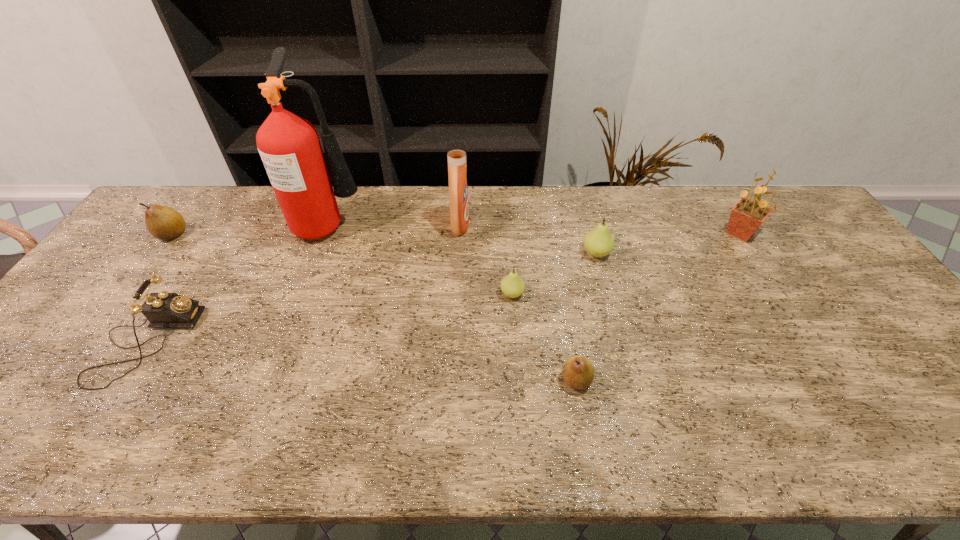
This screenshot has width=960, height=540. Identify the location of telephone positioned at the left edge. (163, 310).

Find the location of a particular element. object at the far left corner is located at coordinates (164, 223).

Find the location of a particular element. The height and width of the screenshot is (540, 960). vacant space at the far edge of the desktop is located at coordinates (446, 218).

The height and width of the screenshot is (540, 960). I want to click on vacant position at the near edge of the desktop, so click(x=841, y=432).

In the image, there is a desktop. Where is `vacant space at the left edge`? The width and height of the screenshot is (960, 540). vacant space at the left edge is located at coordinates (93, 341).

Locate an element on the screen. Image resolution: width=960 pixels, height=540 pixels. vacant space at the right edge is located at coordinates (846, 256).

Locate an element on the screen. vacant space at the near left corner is located at coordinates (28, 422).

This screenshot has height=540, width=960. In the image, there is a desktop. Identify the location of vacant region at the far right corner. (776, 199).

Image resolution: width=960 pixels, height=540 pixels. In order to click on blank region between the telephone and the right brown pear in this screenshot , I will do `click(361, 361)`.

What are the coordinates of `unoccupied position between the seventh shortest object and the third object from right to left` in the screenshot? It's located at (518, 303).